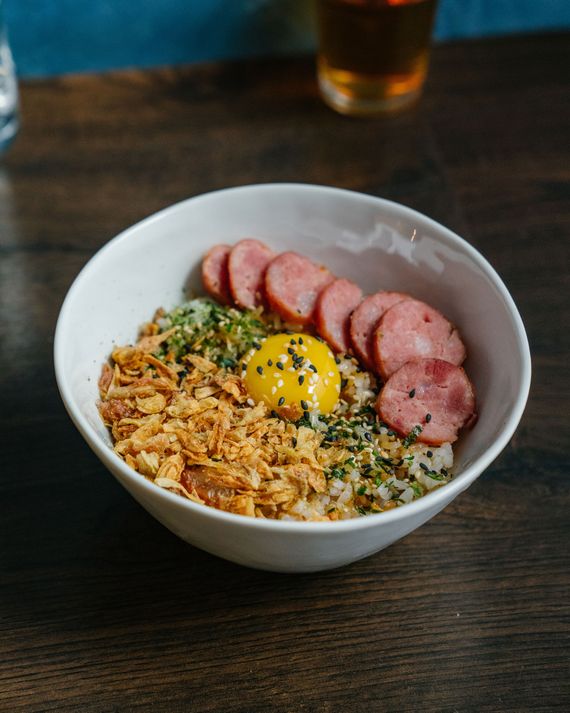
You are a GUI agent. You are given a task and a screenshot of the screen. Output one action in this format:
    pyautogui.click(x=<x>, y=<y>)
    Task: Click on the glass with brown liquid
    The image size is (570, 713).
    Given the screenshot: What is the action you would take?
    pyautogui.click(x=384, y=60)